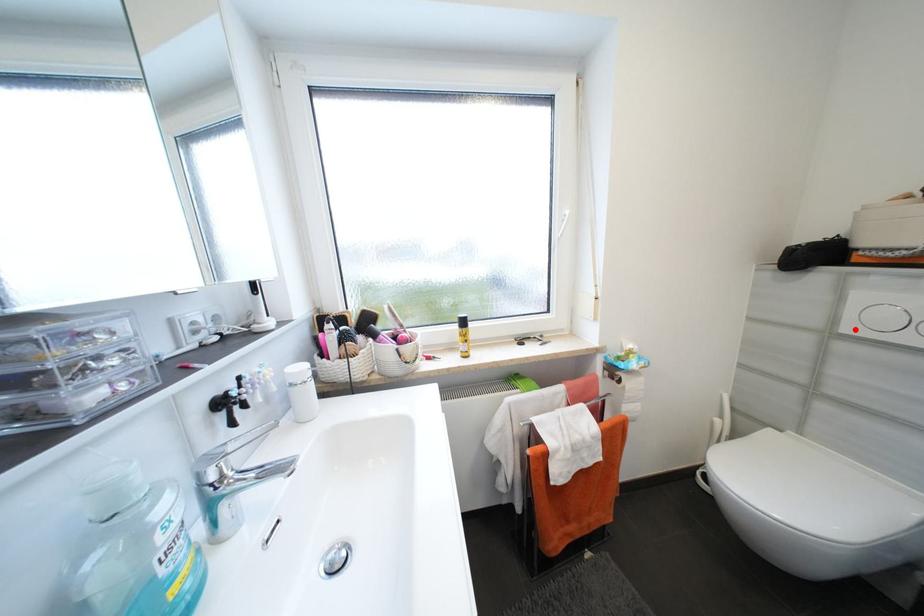
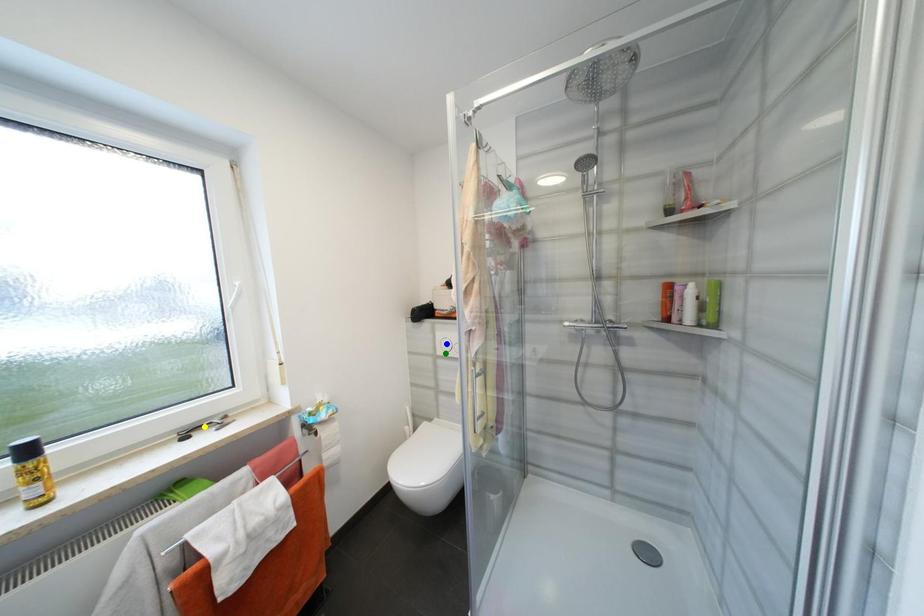
Question: I am providing you with two images of the same scene from different viewpoints. A red point is marked on the first image. You are given multiple points on the second image. In image 2, which mark is for the same physical point as the one in image 1?

Choices:
 (A) green point
 (B) blue point
 (C) yellow point

Answer: (A)